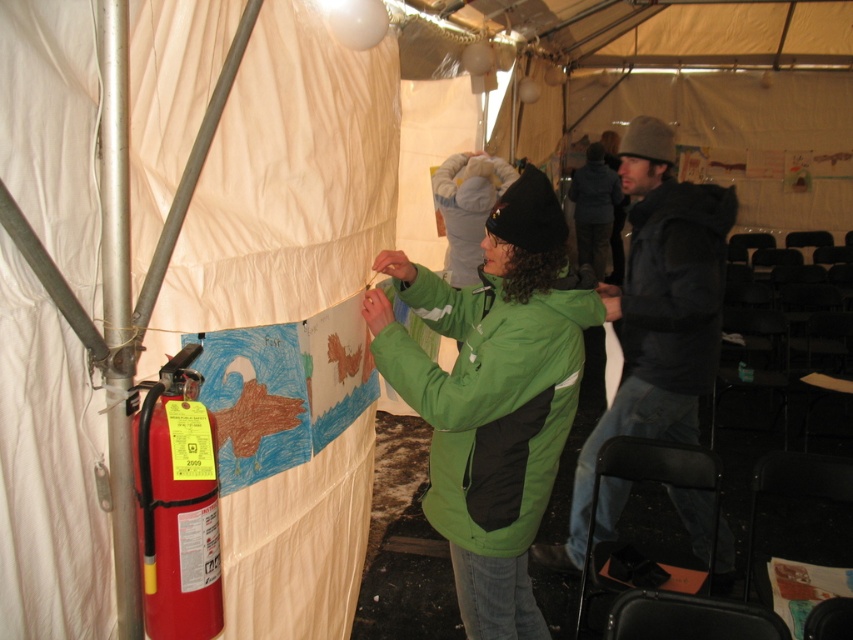
You are a safety inspector checking the tent. You notice the red matte fire extinguisher at lower left and the black matte jacket at right. Which object is wider?

The black matte jacket at right is wider than the red matte fire extinguisher at lower left.